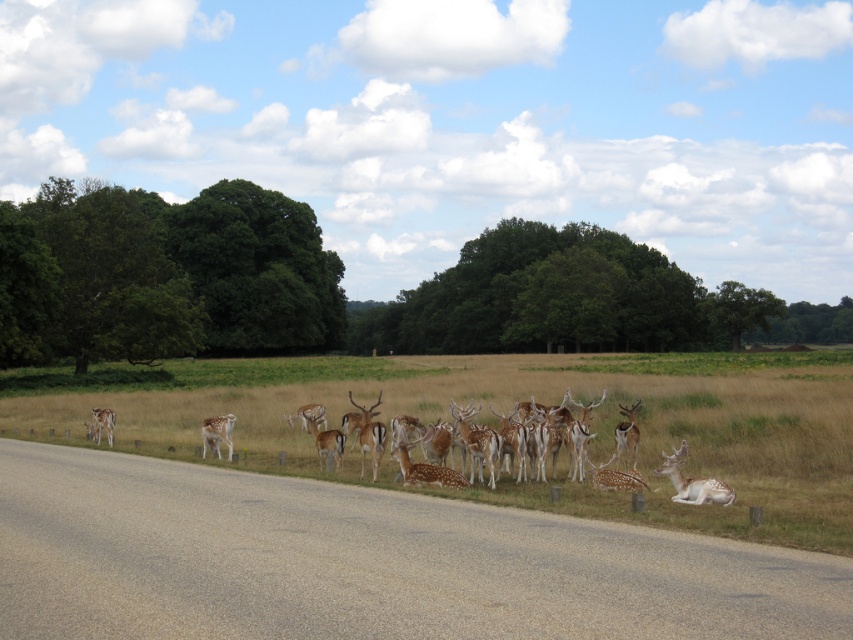
Is fawn fur at road above fawn fur at center?

Incorrect, fawn fur at road is not positioned above fawn fur at center.

Is fawn fur at road wider than fawn fur at center?

Incorrect, fawn fur at road's width does not surpass fawn fur at center's.

Which is in front, point (213, 432) or point (627, 436)?

Point (627, 436) is in front.

This screenshot has height=640, width=853. I want to click on fawn fur at road, so click(x=218, y=433).

Which is in front, point (688, 497) or point (224, 417)?

Positioned in front is point (688, 497).

Is point (692, 484) behind point (221, 422)?

No, (692, 484) is closer to viewer.

Find the location of `spotted fur deer at lower right`. spotted fur deer at lower right is located at coordinates (694, 484).

Can you confirm if fawn-patterned antlers at center is taller than fawn fur at center?

Correct, fawn-patterned antlers at center is much taller as fawn fur at center.

Which of these two, fawn-patterned antlers at center or fawn fur at center, stands shorter?

fawn fur at center is shorter.

Find the location of a particular element. Image resolution: width=853 pixels, height=640 pixels. fawn-patterned antlers at center is located at coordinates (331, 444).